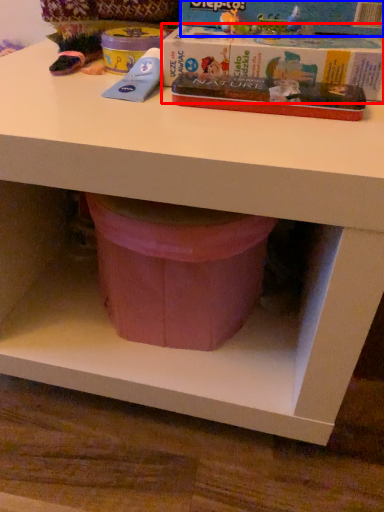
Question: Which of the following is the closest to the observer, paperback book (highlighted by a red box) or paperback book (highlighted by a blue box)?

Choices:
 (A) paperback book
 (B) paperback book

Answer: (A)